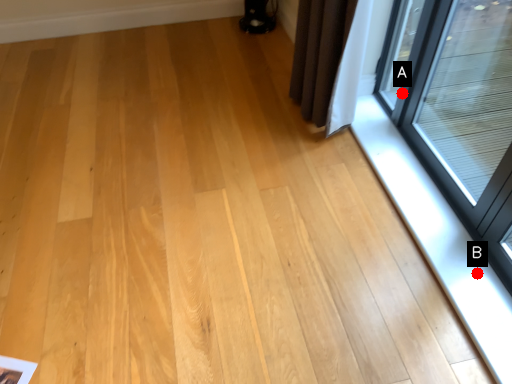
Question: Two points are circled on the image, labeled by A and B beside each circle. Which point appears closest to the camera in this image?

Choices:
 (A) A is closer
 (B) B is closer

Answer: (B)